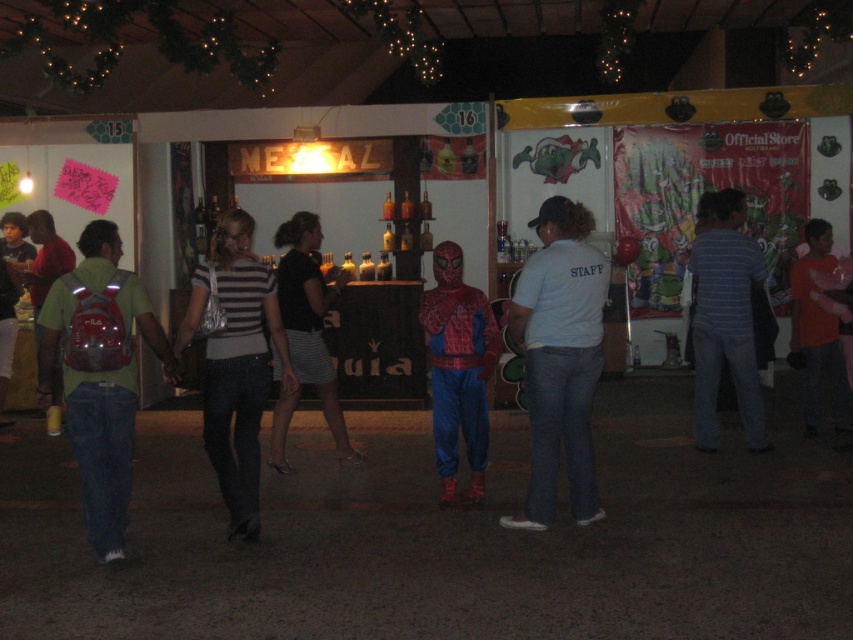
You are at the fair and see two shirts displayed at the right side of the booth. Which shirt is nearer to you, the blue striped shirt at right or the orange cotton shirt at right?

The blue striped shirt at right is closer to the viewer than the orange cotton shirt at right.

Based on the photo, you are organizing a photo shoot and need to ensure that the blue striped shirt at right and the striped fabric skirt at center are visible in the frame. Based on their widths, which item might require more careful positioning to avoid being obscured by other elements?

The blue striped shirt at right has a lesser width compared to the striped fabric skirt at center, so it might require more careful positioning to avoid being obscured by other elements since it is narrower and could be easily missed in the frame.